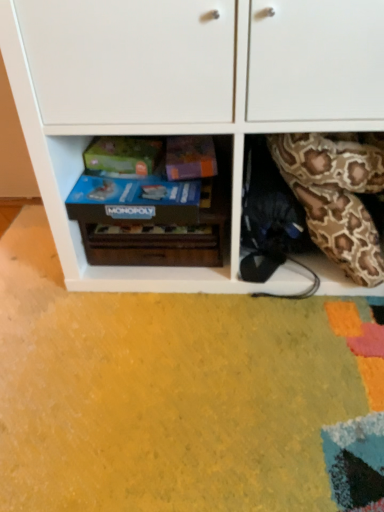
Question: From the image's perspective, is brown patterned fabric at right located above or below white matte cabinet at center?

Choices:
 (A) below
 (B) above

Answer: (A)

Question: In the image, is brown patterned fabric at right positioned in front of or behind white matte cabinet at center?

Choices:
 (A) behind
 (B) front

Answer: (A)

Question: Considering the real-world distances, which object is closest to the blue cardboard monopoly game at center?

Choices:
 (A) white matte cabinet at center
 (B) wooden monopoly game at center
 (C) brown patterned fabric at right

Answer: (B)

Question: Based on their relative distances, which object is farther from the brown patterned fabric at right?

Choices:
 (A) wooden monopoly game at center
 (B) blue cardboard monopoly game at center
 (C) white matte cabinet at center

Answer: (B)